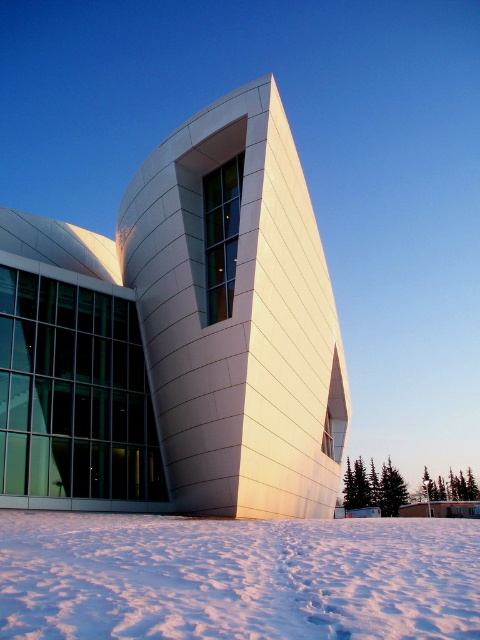
You are a photographer planning to capture the white smooth building at center and the white powdery snow at lower center in a single frame. Based on their sizes, which object should you focus on to ensure both are clearly visible in the photo?

The white smooth building at center has a larger size compared to the white powdery snow at lower center. To ensure both are clearly visible, focus on the white smooth building at center since it occupies more space in the frame, allowing the snow to be captured in the foreground without being too small.

You are standing in front of the white smooth building at center and want to walk to the white powdery snow at lower center. Which direction should you move to reach the snow?

You should move forward towards the white powdery snow at lower center because the white smooth building at center is closer to you, and the snow is located behind it.

You are standing in front of the modern architectural structure and want to determine the relative positions of two points on the building. The first point is at coordinates point (314, 436) and the second is at point (381, 620). Which point is closer to you?

Point (314, 436) is further to the camera than point (381, 620). Therefore, point (381, 620) is closer to you.